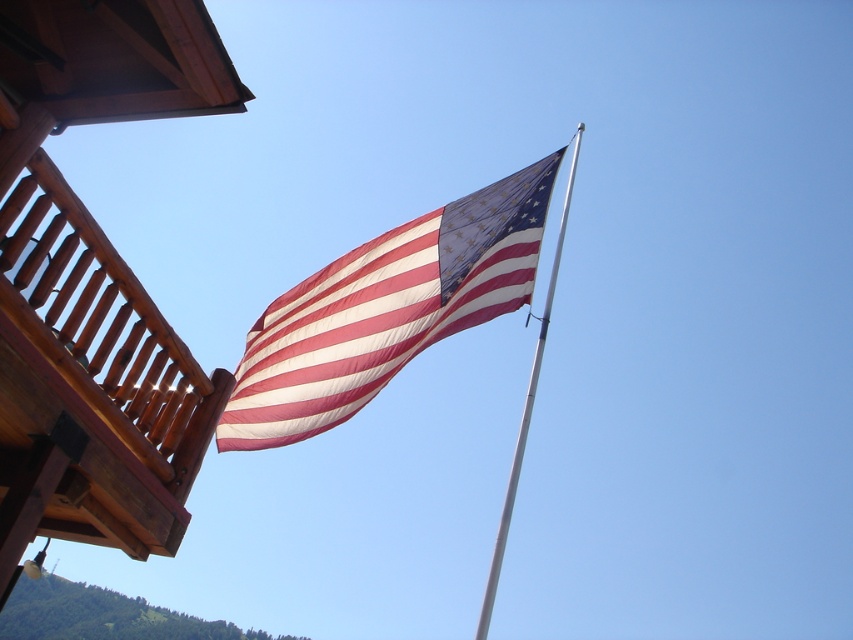
You are standing in front of the flagpole and want to touch both the textured cotton flag at center and the silver metallic flag pole at upper center. Which object will you need to reach out further to touch?

The silver metallic flag pole at upper center is further away from you than the textured cotton flag at center, so you will need to reach out further to touch the silver metallic flag pole at upper center.

You are standing in front of the flagpole and notice the textured cotton flag at center and the silver metallic flag pole at upper center. Which object is positioned to the left of the other?

The textured cotton flag at center is positioned to the left of the silver metallic flag pole at upper center.

You are standing in front of the flagpole and want to determine which of the two points, point (321, 376) or point (521, 452), is closer to you. Based on the scene, which point is nearer?

Point (321, 376) is further to the camera than point (521, 452), so the closer point to you is point (521, 452).